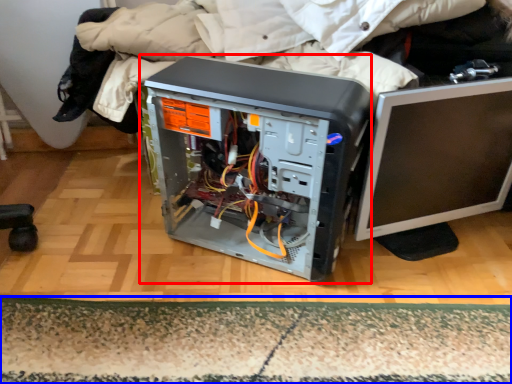
Question: Among these objects, which one is farthest to the camera, computer tower (highlighted by a red box) or mat (highlighted by a blue box)?

Choices:
 (A) computer tower
 (B) mat

Answer: (B)